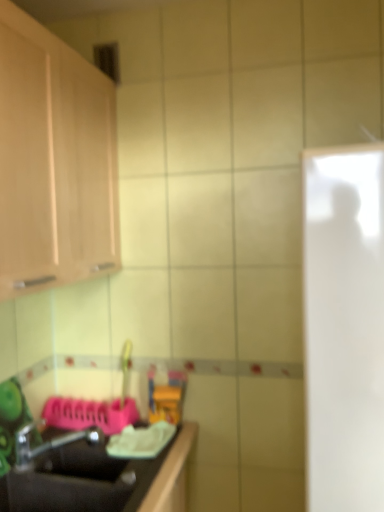
Question: From a real-world perspective, is metallic silver faucet at lower left on top of white glossy door at right?

Choices:
 (A) no
 (B) yes

Answer: (A)

Question: From a real-world perspective, does metallic silver faucet at lower left sit lower than white glossy door at right?

Choices:
 (A) yes
 (B) no

Answer: (A)

Question: Is metallic silver faucet at lower left smaller than white glossy door at right?

Choices:
 (A) yes
 (B) no

Answer: (A)

Question: Is metallic silver faucet at lower left wider than white glossy door at right?

Choices:
 (A) no
 (B) yes

Answer: (A)

Question: Could you tell me if metallic silver faucet at lower left is turned towards white glossy door at right?

Choices:
 (A) no
 (B) yes

Answer: (B)

Question: Does point (155, 480) appear closer or farther from the camera than point (57, 251)?

Choices:
 (A) farther
 (B) closer

Answer: (A)

Question: Looking at the image, does black matte sink at lower left seem bigger or smaller compared to light wood cabinet at upper left?

Choices:
 (A) big
 (B) small

Answer: (B)

Question: Would you say black matte sink at lower left is to the left or to the right of light wood cabinet at upper left in the picture?

Choices:
 (A) left
 (B) right

Answer: (B)

Question: From the image's perspective, is black matte sink at lower left above or below light wood cabinet at upper left?

Choices:
 (A) above
 (B) below

Answer: (B)

Question: Is white glossy door at right taller or shorter than metallic silver faucet at lower left?

Choices:
 (A) tall
 (B) short

Answer: (A)

Question: Is point (317, 367) positioned closer to the camera than point (84, 435)?

Choices:
 (A) farther
 (B) closer

Answer: (B)

Question: Is white glossy door at right wider or thinner than metallic silver faucet at lower left?

Choices:
 (A) thin
 (B) wide

Answer: (B)

Question: From a real-world perspective, is white glossy door at right positioned above or below metallic silver faucet at lower left?

Choices:
 (A) above
 (B) below

Answer: (A)

Question: From the image's perspective, is white glossy door at right positioned above or below black matte sink at lower left?

Choices:
 (A) below
 (B) above

Answer: (B)

Question: Is white glossy door at right situated inside black matte sink at lower left or outside?

Choices:
 (A) outside
 (B) inside

Answer: (A)